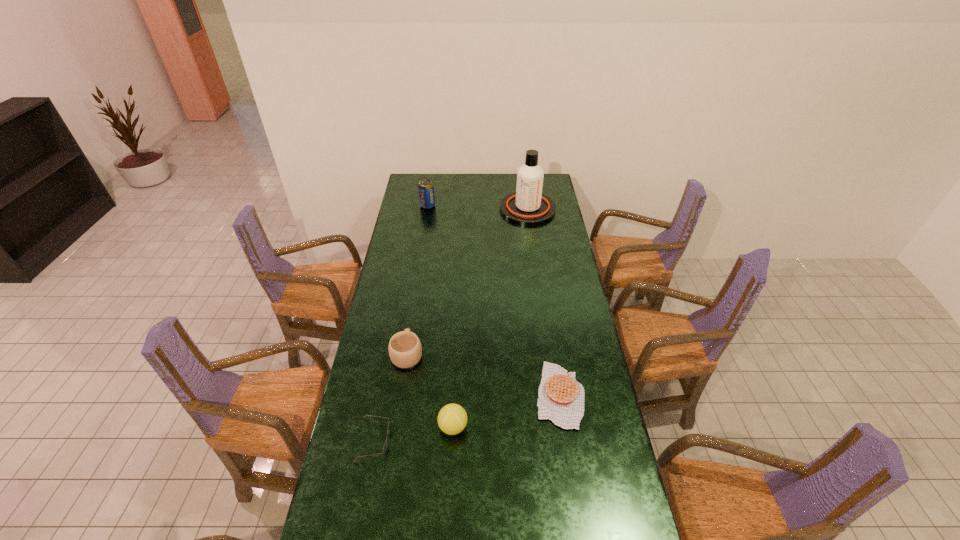
Find the location of a particular element. This screenshot has height=540, width=960. the tallest object is located at coordinates (528, 206).

The image size is (960, 540). I want to click on the fifth shortest object, so click(425, 187).

This screenshot has height=540, width=960. In order to click on the third object from right to left in this screenshot , I will do `click(452, 419)`.

You are a GUI agent. You are given a task and a screenshot of the screen. Output one action in this format:
    pyautogui.click(x=<x>, y=<y>)
    Task: Click on the mug
    
    Given the screenshot: What is the action you would take?
    pyautogui.click(x=405, y=351)

Identify the location of pie. (560, 397).

This screenshot has width=960, height=540. I want to click on sunglasses, so click(x=386, y=441).

Where is `free point located 0.270m on the left of the tallest object`? free point located 0.270m on the left of the tallest object is located at coordinates coord(450,210).

You are a GUI agent. You are given a task and a screenshot of the screen. Output one action in this format:
    pyautogui.click(x=<x>, y=<y>)
    Task: Click on the free spot located 0.090m on the right of the soda
    Image resolution: width=960 pixels, height=540 pixels.
    Given the screenshot: What is the action you would take?
    pyautogui.click(x=451, y=206)

Find the location of a particular element. The width and height of the screenshot is (960, 540). vacant space located on the right of the tennis ball is located at coordinates (511, 427).

Image resolution: width=960 pixels, height=540 pixels. In order to click on vacant space located 0.050m on the side of the mug with the handle in this screenshot , I will do `click(411, 329)`.